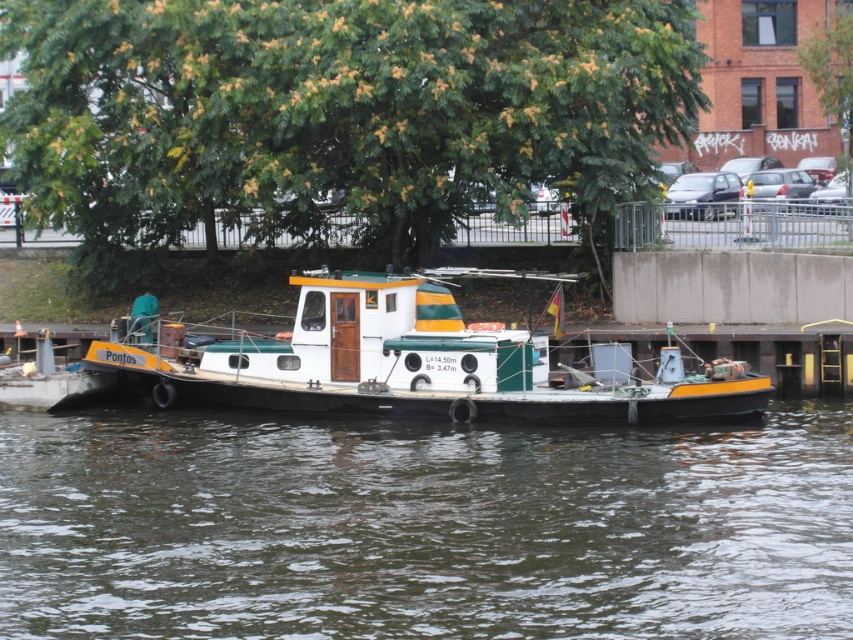
Between point (317, 508) and point (164, 113), which one is positioned in front?

Point (317, 508) is in front.

Can you confirm if transparent water at center is bigger than green leafy tree at upper center?

Actually, transparent water at center might be smaller than green leafy tree at upper center.

Locate an element on the screen. The image size is (853, 640). transparent water at center is located at coordinates (422, 528).

What are the coordinates of `transparent water at center` in the screenshot? It's located at (422, 528).

Is green leafy tree at upper center above white matte boat at center?

Correct, green leafy tree at upper center is located above white matte boat at center.

Does green leafy tree at upper center have a greater width compared to white matte boat at center?

Yes.

Who is more distant from viewer, (622,20) or (426,384)?

The point (622,20) is more distant.

The height and width of the screenshot is (640, 853). Identify the location of green leafy tree at upper center. click(x=339, y=109).

Can you confirm if transparent water at center is positioned to the right of white matte boat at center?

Correct, you'll find transparent water at center to the right of white matte boat at center.

Based on the photo, is transparent water at center further to camera compared to white matte boat at center?

That is False.

Locate an element on the screen. The height and width of the screenshot is (640, 853). transparent water at center is located at coordinates (422, 528).